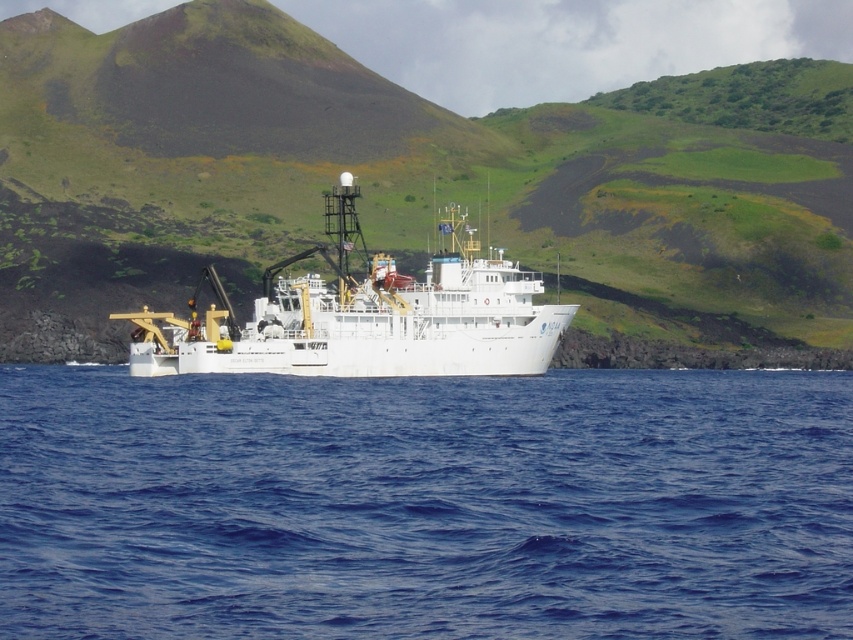
You are a marine biologist observing the scene from a helicopter. You notice the green grassy hillside at center and the white matte ship at center. Which object is closer to your viewpoint?

The green grassy hillside at center is closer to your viewpoint because the white matte ship at center is behind it.

Based on the scene description, where is the green grassy hillside at center located in terms of its 2D coordinates?

The green grassy hillside at center is located at the 2D coordinates of point (416, 186).